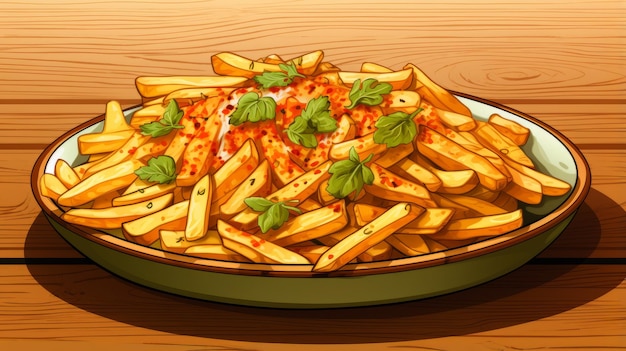
What are the coordinates of `bowl interior` in the screenshot? It's located at (550, 161).